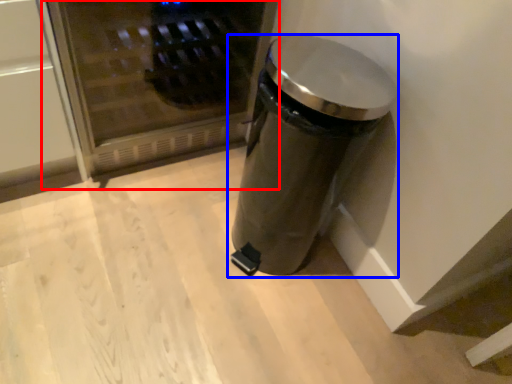
Question: Which object is closer to the camera taking this photo, microwave (highlighted by a red box) or waste container (highlighted by a blue box)?

Choices:
 (A) microwave
 (B) waste container

Answer: (B)